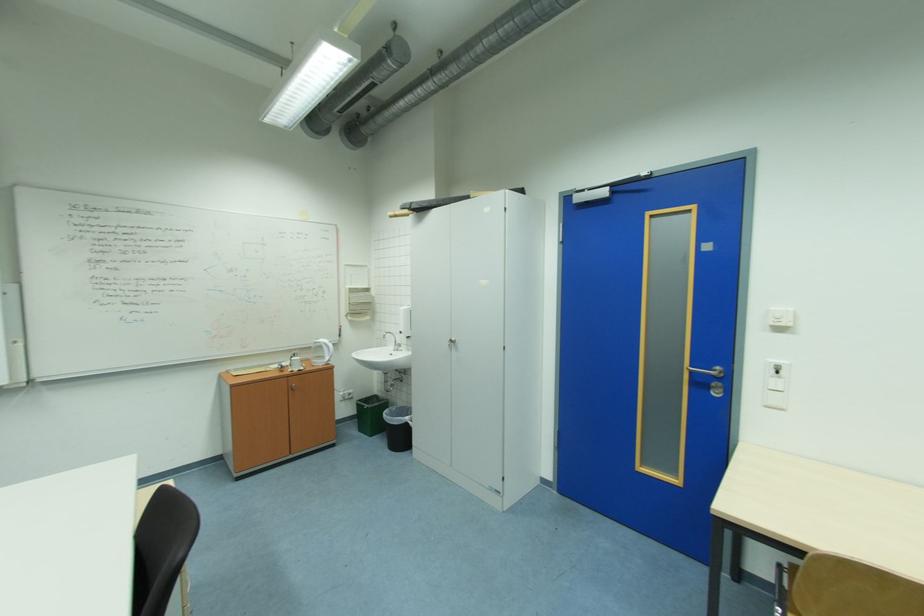
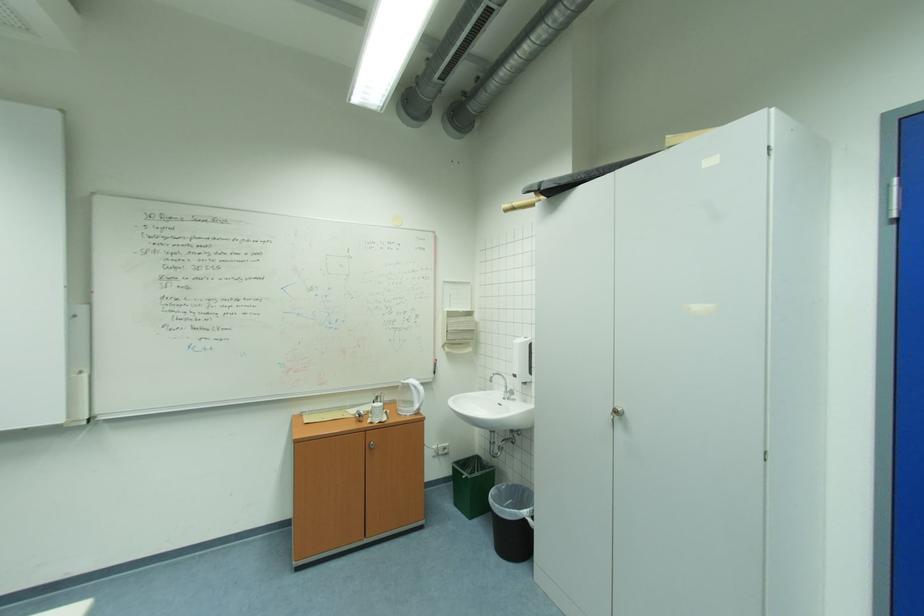
Question: In a continuous first-person perspective shot, in which direction is the camera moving?

Choices:
 (A) Left
 (B) Right
 (C) Forward
 (D) Backward

Answer: (C)